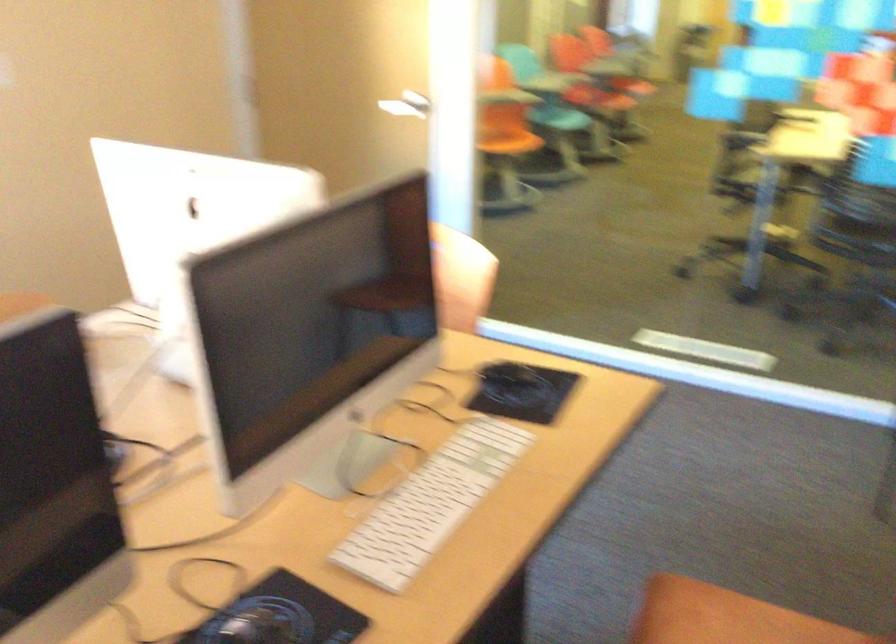
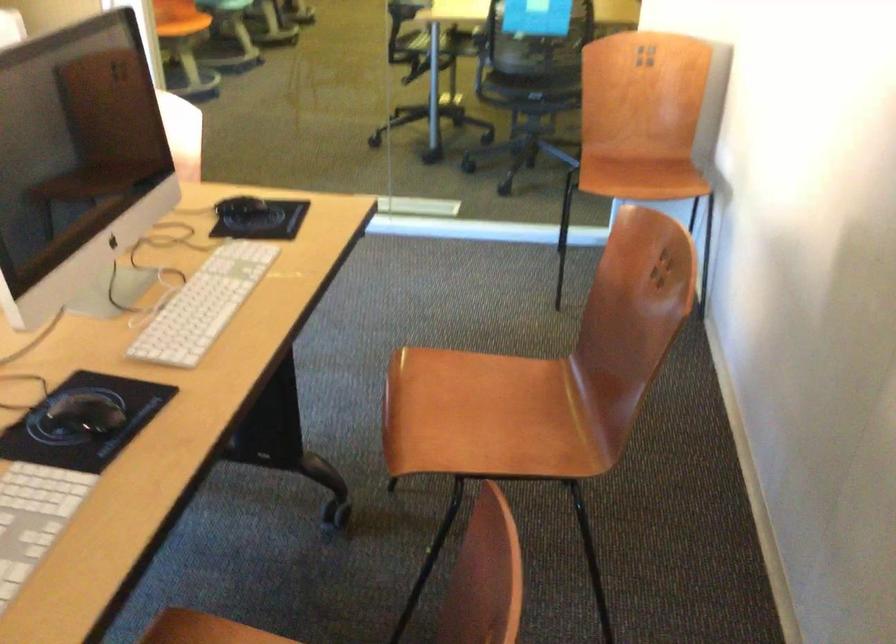
In a continuous first-person perspective shot, in which direction is the camera moving?

The cameraman walked toward left, backward.